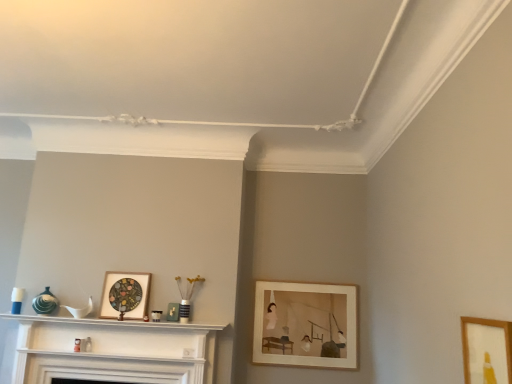
Question: Is point (504, 342) closer or farther from the camera than point (124, 309)?

Choices:
 (A) closer
 (B) farther

Answer: (A)

Question: Which is correct: wooden picture frame at lower right, which is counted as the third picture frame, starting from the left, is inside wooden stained picture frame at center, marked as the first picture frame in a left-to-right arrangement, or outside of it?

Choices:
 (A) outside
 (B) inside

Answer: (A)

Question: Estimate the real-world distances between objects in this image. Which object is farther from the wooden stained picture frame at center, placed as the 3th picture frame when sorted from right to left?

Choices:
 (A) wooden picture frame at lower right, placed as the third picture frame when sorted from back to front
 (B) wooden picture frame at center-right, the 2th picture frame from the right
 (C) white glossy fireplace at center

Answer: (A)

Question: Which object is positioned closest to the wooden picture frame at lower right, which is the first picture frame in front-to-back order?

Choices:
 (A) white glossy fireplace at center
 (B) wooden picture frame at center-right, acting as the 3th picture frame starting from the front
 (C) wooden stained picture frame at center, marked as the first picture frame in a left-to-right arrangement

Answer: (B)